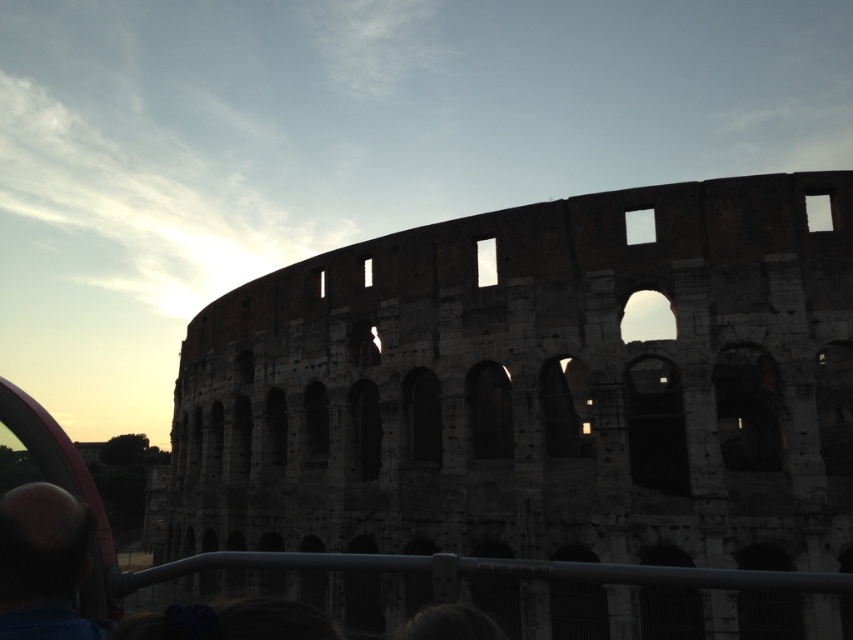
Can you confirm if brown stone amphitheater at center is taller than smooth bald head at lower left?

Yes, brown stone amphitheater at center is taller than smooth bald head at lower left.

Between brown stone amphitheater at center and smooth bald head at lower left, which one is positioned higher?

Positioned higher is brown stone amphitheater at center.

You are a GUI agent. You are given a task and a screenshot of the screen. Output one action in this format:
    pyautogui.click(x=<x>, y=<y>)
    Task: Click on the brown stone amphitheater at center
    Image resolution: width=853 pixels, height=640 pixels.
    Given the screenshot: What is the action you would take?
    [x=538, y=388]